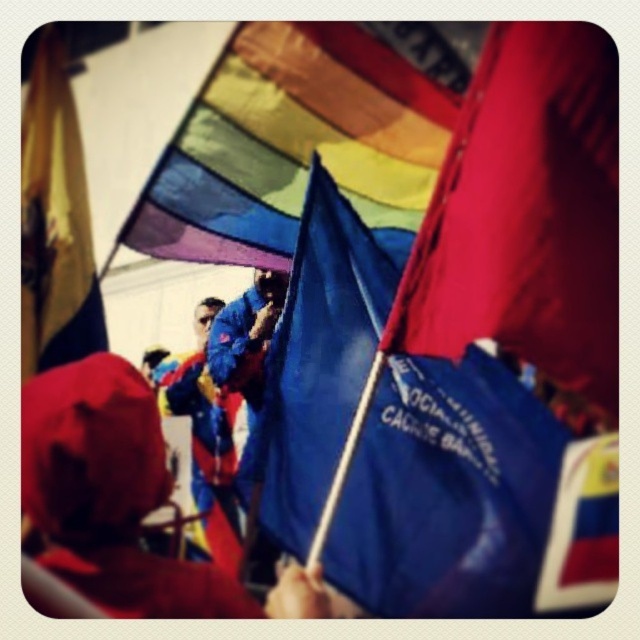
Is blue fabric flag at center positioned in front of red fabric hat at lower left?

That is False.

Where is `blue fabric flag at center`? blue fabric flag at center is located at coordinates (448, 492).

Is point (280, 541) positioned behind point (83, 401)?

Yes, it is behind point (83, 401).

You are a GUI agent. You are given a task and a screenshot of the screen. Output one action in this format:
    pyautogui.click(x=<x>, y=<y>)
    Task: Click on the blue fabric flag at center
    
    Given the screenshot: What is the action you would take?
    pyautogui.click(x=448, y=492)

Is blue fabric flag at center wider than yellow fabric flag at left?

Indeed, blue fabric flag at center has a greater width compared to yellow fabric flag at left.

In the scene shown: Does blue fabric flag at center have a greater height compared to yellow fabric flag at left?

Indeed, blue fabric flag at center has a greater height compared to yellow fabric flag at left.

The height and width of the screenshot is (640, 640). Describe the element at coordinates (448, 492) in the screenshot. I see `blue fabric flag at center` at that location.

You are a GUI agent. You are given a task and a screenshot of the screen. Output one action in this format:
    pyautogui.click(x=<x>, y=<y>)
    Task: Click on the blue fabric flag at center
    The height and width of the screenshot is (640, 640).
    Given the screenshot: What is the action you would take?
    pyautogui.click(x=448, y=492)

Which is above, yellow fabric flag at left or polished plastic flag at lower right?

Positioned higher is yellow fabric flag at left.

Between point (54, 300) and point (547, 564), which one is positioned behind?

Point (54, 300)

Locate an element on the screen. yellow fabric flag at left is located at coordinates (54, 221).